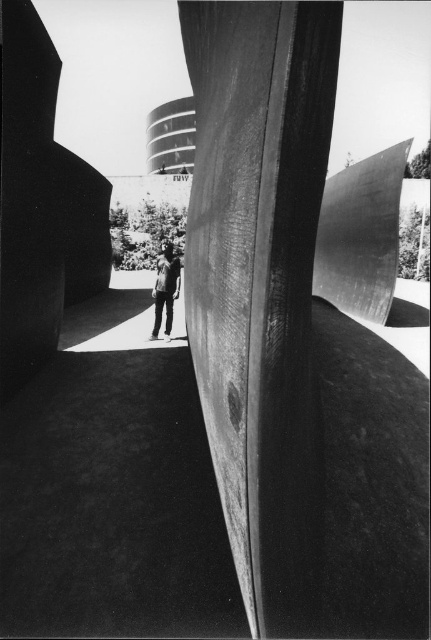
From the picture: You are a photographer trying to capture the wooden sculpture at center and the dark gray jeans at center in a single frame. Based on their sizes, can you fit both objects in your camera view without moving closer or farther?

The wooden sculpture at center might be wider than dark gray jeans at center, so there is a possibility that the sculpture occupies more space in the frame. However, since the jeans belong to a person near the base, they might still be visible alongside the sculpture if the camera angle allows capturing both. Ensure the view includes the entire sculpture and the person at its base.

You are standing at the point marked by coordinates point (x=293, y=344) in the image. Looking around, you see the wooden sculpture at center. Which direction should you face to see the background that is partially obscured by the sculpture?

Since the wooden sculpture at center is located at point (x=293, y=344), facing away from the sculpture would allow you to see the background that is partially obscured by it.

You are standing in front of the sculpture and want to take a photo of the dark gray jeans at center without the wooden sculpture at center blocking the view. Is this possible?

The wooden sculpture at center is closer to the viewer than the dark gray jeans at center, so the wooden sculpture at center would block the view of the dark gray jeans at center. Therefore, it is not possible to take a photo of the dark gray jeans at center without the wooden sculpture at center blocking the view.